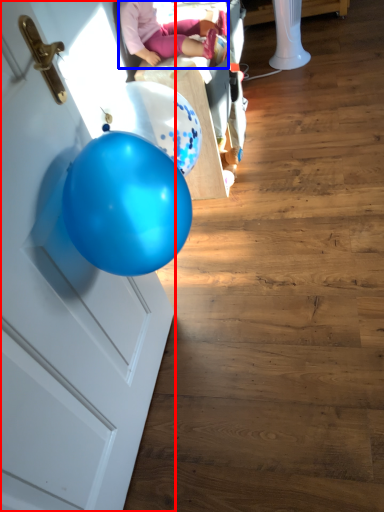
Question: Which object appears farthest to the camera in this image, door (highlighted by a red box) or person (highlighted by a blue box)?

Choices:
 (A) door
 (B) person

Answer: (B)